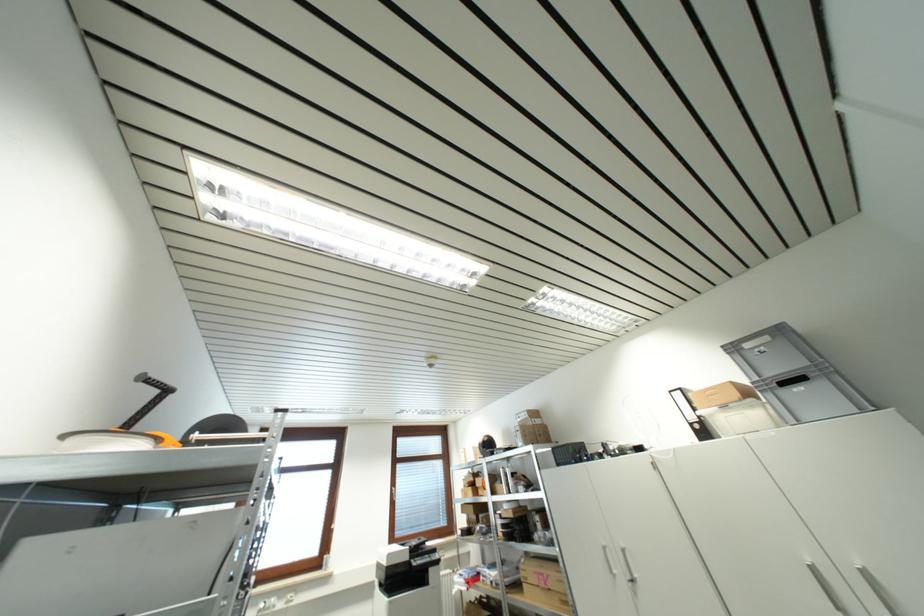
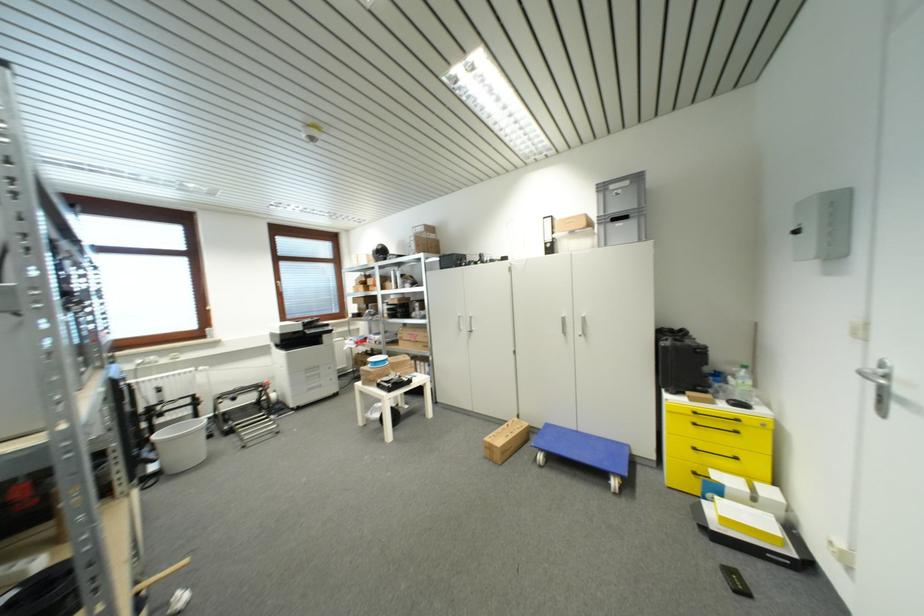
Find the pixel in the second image that matches point 428,541 in the first image.

(320, 321)